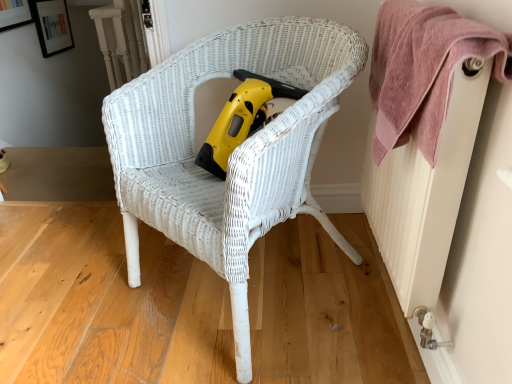
Question: Is white wicker chair at center with white textured radiator at right?

Choices:
 (A) no
 (B) yes

Answer: (A)

Question: Does white wicker chair at center have a lesser height compared to white textured radiator at right?

Choices:
 (A) yes
 (B) no

Answer: (B)

Question: Can you confirm if white wicker chair at center is bigger than white textured radiator at right?

Choices:
 (A) no
 (B) yes

Answer: (B)

Question: Can you confirm if white wicker chair at center is positioned to the right of white textured radiator at right?

Choices:
 (A) no
 (B) yes

Answer: (A)

Question: Is white wicker chair at center oriented away from white textured radiator at right?

Choices:
 (A) yes
 (B) no

Answer: (B)

Question: Does white wicker chair at center have a greater height compared to white textured radiator at right?

Choices:
 (A) no
 (B) yes

Answer: (B)

Question: From a real-world perspective, is pink textured towel at upper right under white textured radiator at right?

Choices:
 (A) no
 (B) yes

Answer: (A)

Question: Is pink textured towel at upper right touching white textured radiator at right?

Choices:
 (A) no
 (B) yes

Answer: (A)

Question: Is pink textured towel at upper right located outside white textured radiator at right?

Choices:
 (A) no
 (B) yes

Answer: (A)

Question: Can white textured radiator at right be found inside pink textured towel at upper right?

Choices:
 (A) yes
 (B) no

Answer: (A)

Question: Is pink textured towel at upper right behind white textured radiator at right?

Choices:
 (A) no
 (B) yes

Answer: (B)

Question: Is pink textured towel at upper right shorter than white textured radiator at right?

Choices:
 (A) no
 (B) yes

Answer: (B)

Question: Can you confirm if white textured radiator at right is shorter than pink textured towel at upper right?

Choices:
 (A) no
 (B) yes

Answer: (A)